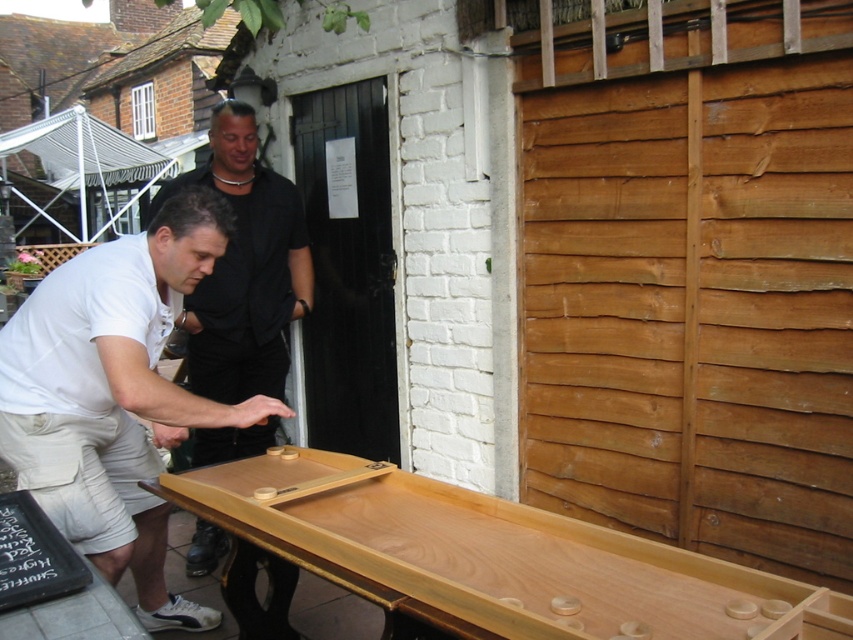
Is white cotton shirt at center taller than matte black shirt at center?

No, white cotton shirt at center is not taller than matte black shirt at center.

From the picture: Does white cotton shirt at center appear under matte black shirt at center?

Yes, white cotton shirt at center is below matte black shirt at center.

Locate an element on the screen. This screenshot has width=853, height=640. white cotton shirt at center is located at coordinates (114, 396).

Measure the distance between natural wood shuffleboard at center and matte black shirt at center.

A distance of 1.44 meters exists between natural wood shuffleboard at center and matte black shirt at center.

Can you confirm if natural wood shuffleboard at center is bigger than matte black shirt at center?

Actually, natural wood shuffleboard at center might be smaller than matte black shirt at center.

Which is in front, point (409, 509) or point (259, 298)?

Point (409, 509)

You are a GUI agent. You are given a task and a screenshot of the screen. Output one action in this format:
    pyautogui.click(x=<x>, y=<y>)
    Task: Click on the natural wood shuffleboard at center
    
    Given the screenshot: What is the action you would take?
    pyautogui.click(x=491, y=556)

Who is positioned more to the right, natural wood shuffleboard at center or white cotton shirt at center?

natural wood shuffleboard at center is more to the right.

Can you confirm if natural wood shuffleboard at center is positioned below white cotton shirt at center?

Correct, natural wood shuffleboard at center is located below white cotton shirt at center.

Consider the image. Who is more forward, (611, 566) or (177, 269)?

Point (611, 566)

Where is `natural wood shuffleboard at center`? This screenshot has width=853, height=640. natural wood shuffleboard at center is located at coordinates (491, 556).